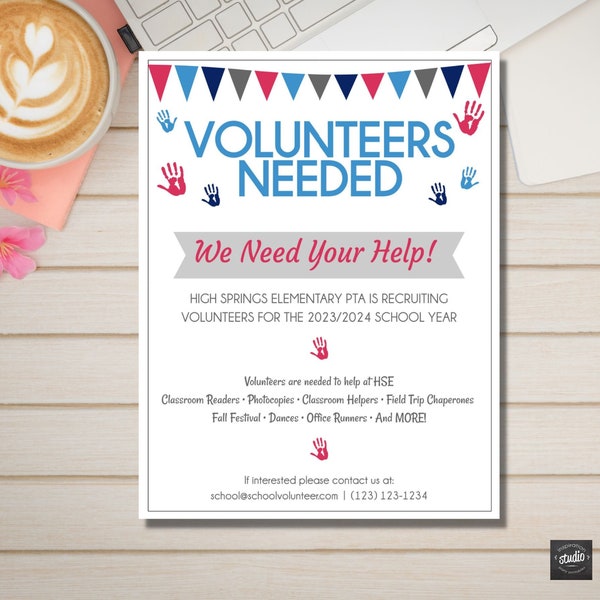
Find the location of a particular element. light wood background is located at coordinates (109, 437).